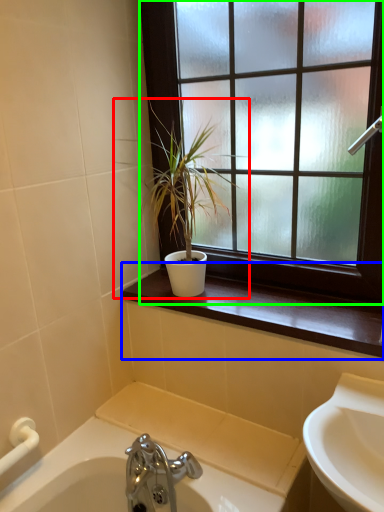
Question: Considering the real-world distances, which object is closest to houseplant (highlighted by a red box)? window sill (highlighted by a blue box) or window (highlighted by a green box).

Choices:
 (A) window sill
 (B) window

Answer: (B)